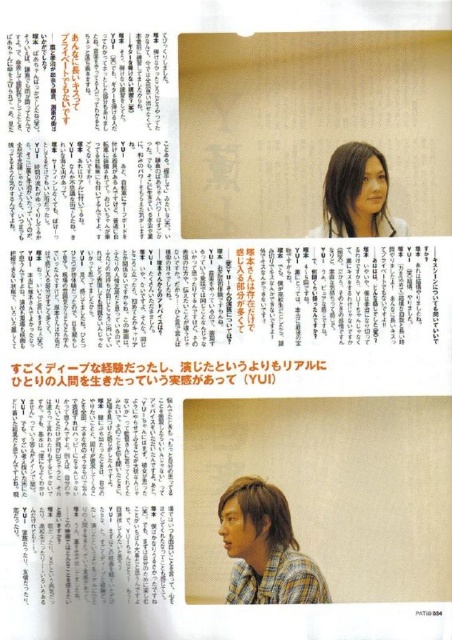
You are looking at the magazine page and notice a specific point marked at coordinates point (278, 589). If you want to touch this point with a pen that has a length of 1 meter, can the pen reach the point from your current position?

The point (278, 589) is 1.21 meters away from the viewer. Since the pen is only 1 meter long, it cannot reach the point from the current position.

You are organizing a clothing store and need to arrange the checkered fabric shirt at center and the plaid cotton shirt at lower right. According to the image, which shirt is placed higher?

The checkered fabric shirt at center is positioned over the plaid cotton shirt at lower right, so the checkered fabric shirt at center is placed higher.

You are designing a layout for a magazine spread. The scene has a yellow papertexturedpaper at upper center and a plaid cotton shirt at lower right. Given their widths, which object should you consider adjusting to ensure they fit within the page margins without overlapping?

The yellow papertexturedpaper at upper center has a greater width than the plaid cotton shirt at lower right. To prevent overlapping and ensure they fit within the page margins, adjust the size or position of the yellow papertexturedpaper at upper center since it is wider.